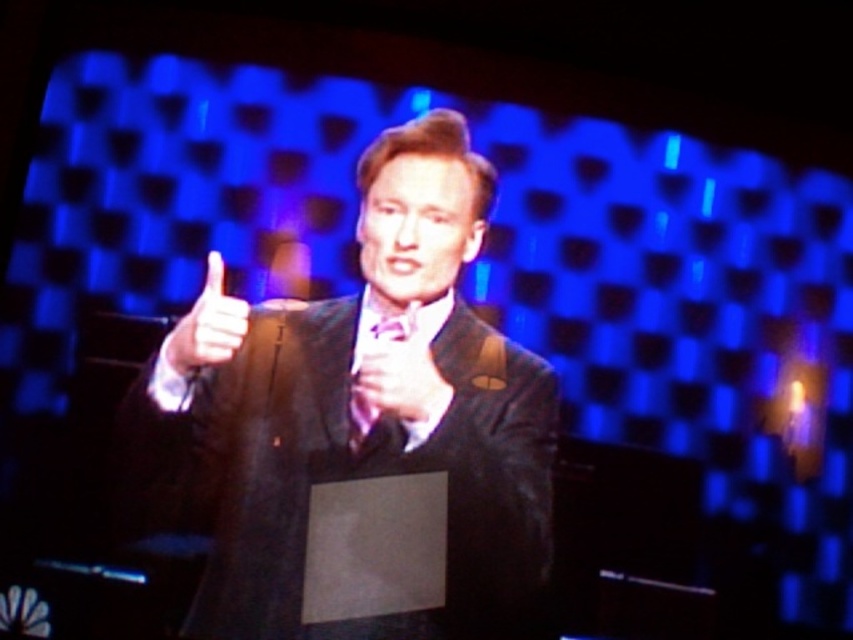
You are an event photographer at a formal event. You need to capture a photo of the speaker while ensuring both the matte black hand at center and the matte purple tie at center are visible. Based on their positions, which side of the speaker should you position yourself to best frame both objects in the shot?

To best frame both the matte black hand at center and the matte purple tie at center, you should position yourself to the left of the speaker. Since the matte black hand at center is to the right of the matte purple tie at center, positioning yourself on the left side allows both objects to be naturally included within the camera frame without one blocking the other.

You are an event planner setting up a camera for a live stream. The camera is positioned to capture both the matte black hand at center and the matte purple tie at center. Which object will appear lower in the frame?

The matte black hand at center appears lower in the frame because it has a lesser height compared to the matte purple tie at center.